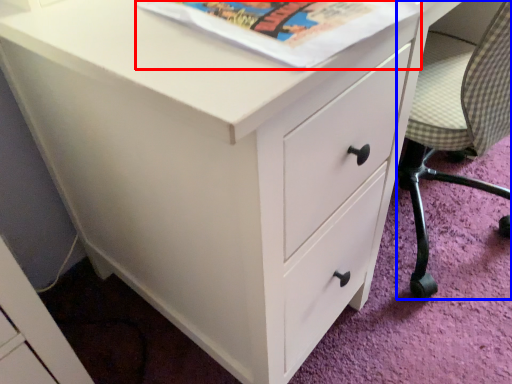
Question: Which of the following is the closest to the observer, paperback book (highlighted by a red box) or armchair (highlighted by a blue box)?

Choices:
 (A) paperback book
 (B) armchair

Answer: (A)